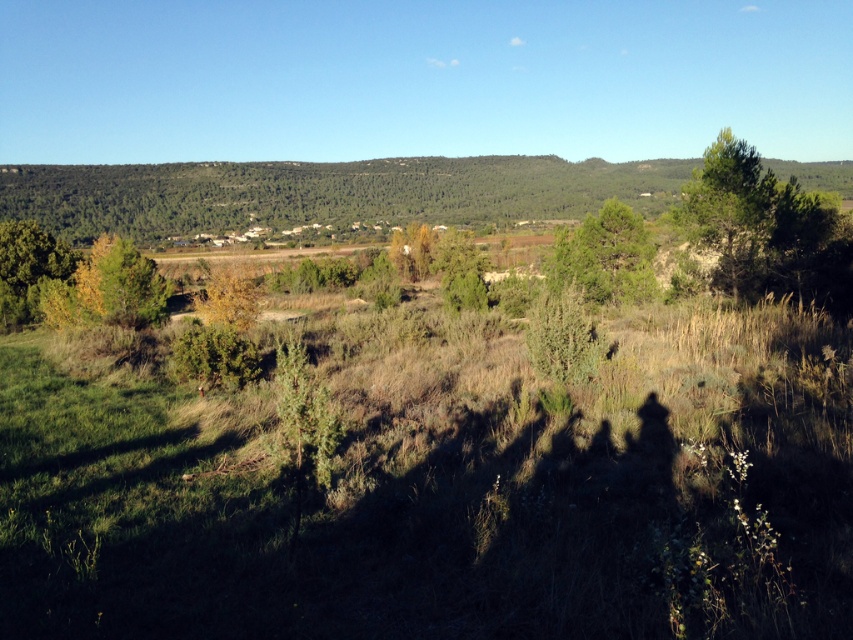
You are standing at the point marked by the coordinates point (x=107, y=289) in the image. Looking around, you notice a yellow green leafy tree at center left. What direction should you walk to reach the nearest dry grass area?

The nearest dry grass area is located to the right of the yellow green leafy tree at center left, so you should walk towards the right to reach it.

You are standing in the middle of the field and see the green textured tree at center and the green leafy tree at left. Which tree is positioned to the right of the other?

The green textured tree at center is positioned to the right of the green leafy tree at left.